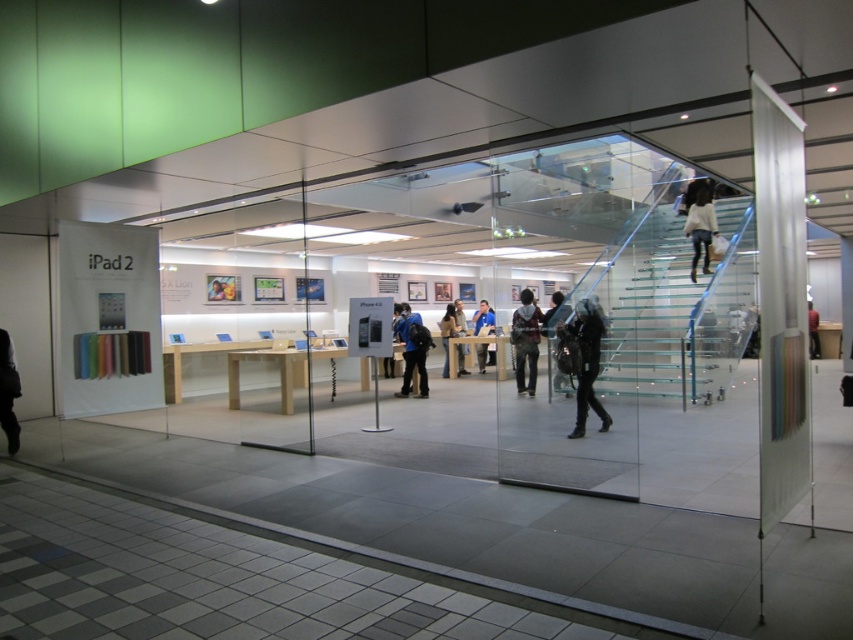
Question: Does dark blue backpack at center lie behind dark blue jeans at upper right?

Choices:
 (A) yes
 (B) no

Answer: (B)

Question: Estimate the real-world distances between objects in this image. Which object is farther from the dark blue backpack at center?

Choices:
 (A) transparent glass stairs at upper center
 (B) transparent glass staircase at upper center
 (C) black leather jacket at lower left

Answer: (C)

Question: Among these points, which one is nearest to the camera?

Choices:
 (A) (646, 241)
 (B) (560, 328)
 (C) (734, 333)
 (D) (485, 348)

Answer: (B)

Question: Considering the relative positions of dark gray leather jacket at center and blue fabric jacket at center in the image provided, where is dark gray leather jacket at center located with respect to blue fabric jacket at center?

Choices:
 (A) left
 (B) right

Answer: (B)

Question: Does transparent glass staircase at upper center appear on the right side of light brown leather jacket at center?

Choices:
 (A) yes
 (B) no

Answer: (A)

Question: Which object is the farthest from the transparent glass staircase at upper center?

Choices:
 (A) light brown leather jacket at center
 (B) dark blue backpack at center

Answer: (A)